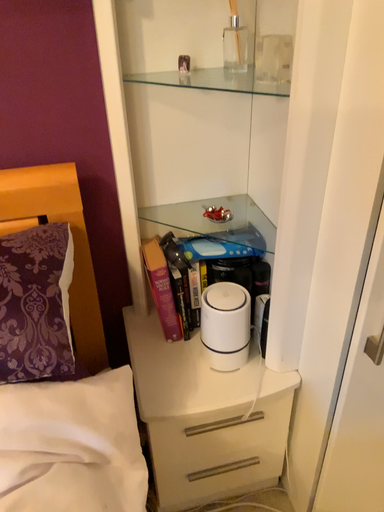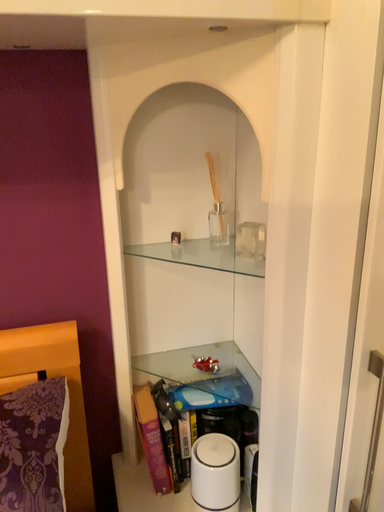
Question: Which way did the camera rotate in the video?

Choices:
 (A) rotated downward
 (B) rotated upward

Answer: (B)